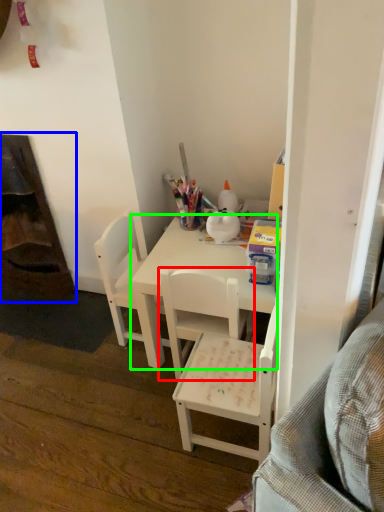
Question: Based on their relative distances, which object is nearer to chair (highlighted by a red box)? Choose from fireplace (highlighted by a blue box) and desk (highlighted by a green box).

Choices:
 (A) fireplace
 (B) desk

Answer: (B)